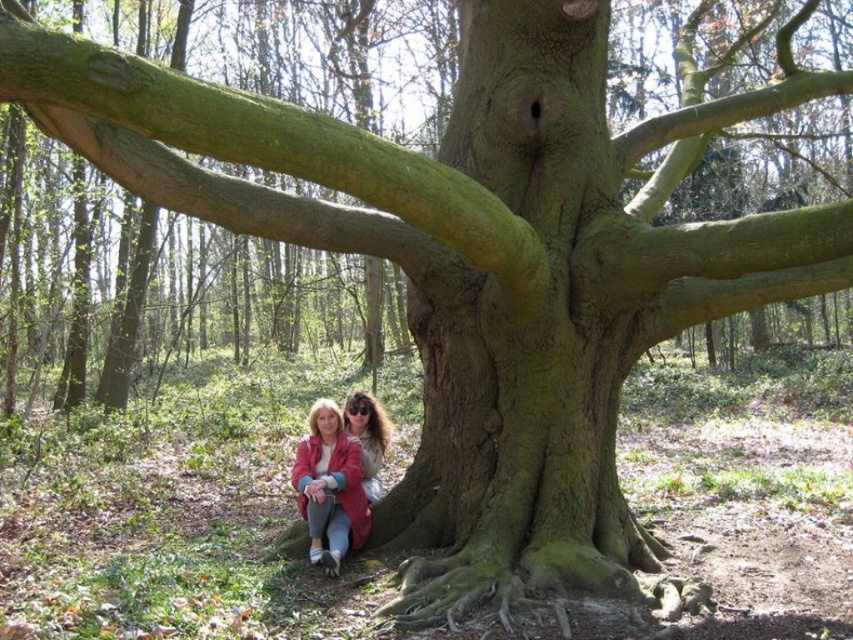
You are a photographer trying to capture a closeup of the matte pink coat at lower center. Based on the coordinates provided, which direction should you move your camera to focus on it?

The matte pink coat at lower center is located at coordinates point (x=329, y=486). To focus on it, move the camera towards the lower center direction.

You are a photographer setting up a shot in the forest scene. You need to place a small tripod between the two people wearing the matte pink coat at lower center and the matte pink jacket at lower center. The tripod requires at least 30 centimeters of space. Can you fit it between them?

The distance between the matte pink coat at lower center and the matte pink jacket at lower center is 32.27 centimeters, which is more than the required 30 centimeters. Therefore, the tripod can be placed between them with enough space.